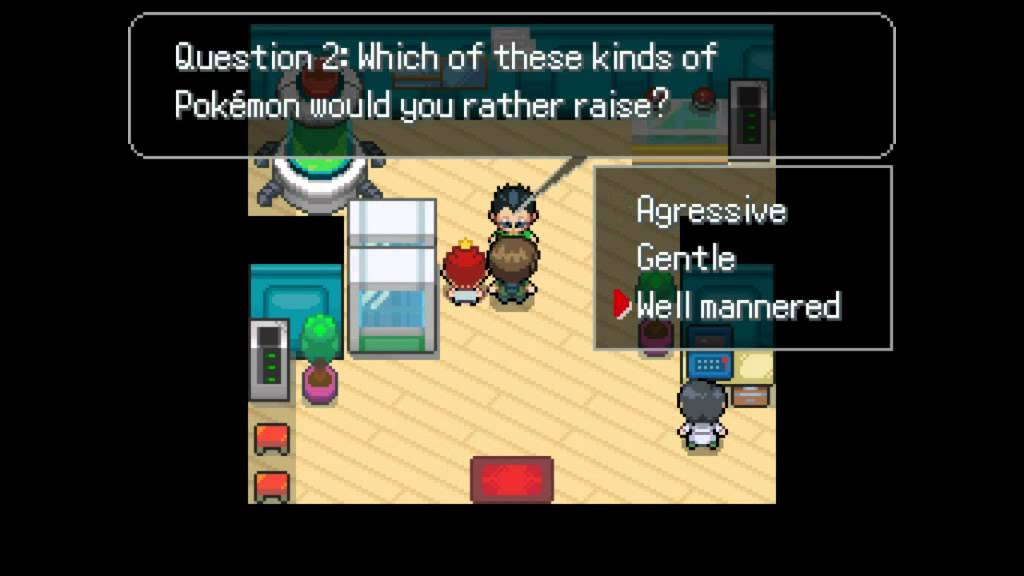
The image size is (1024, 576). I want to click on floor mat, so click(508, 476).